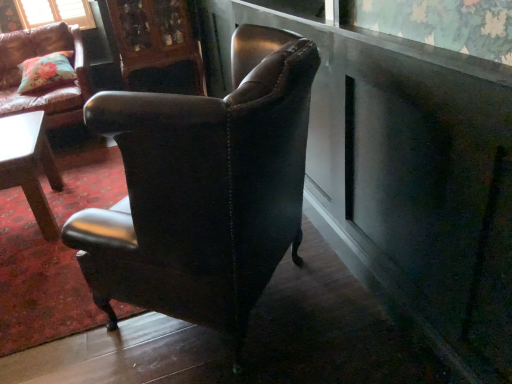
Question: Is floral fabric pillow at upper left facing towards wooden carved cabinet at upper center?

Choices:
 (A) no
 (B) yes

Answer: (A)

Question: From the image's perspective, does floral fabric pillow at upper left appear higher than wooden carved cabinet at upper center?

Choices:
 (A) yes
 (B) no

Answer: (B)

Question: From a real-world perspective, is floral fabric pillow at upper left positioned under wooden carved cabinet at upper center based on gravity?

Choices:
 (A) no
 (B) yes

Answer: (A)

Question: From the image's perspective, is floral fabric pillow at upper left below wooden carved cabinet at upper center?

Choices:
 (A) yes
 (B) no

Answer: (A)

Question: Is floral fabric pillow at upper left at the left side of wooden carved cabinet at upper center?

Choices:
 (A) no
 (B) yes

Answer: (B)

Question: Is floral fabric pillow at upper left not near wooden carved cabinet at upper center?

Choices:
 (A) no
 (B) yes

Answer: (A)

Question: Would you say leather cushioned armchair at upper left, which ranks as the 1th chair in left-to-right order, is part of matte brown leather chair at center, the second chair from the left,'s contents?

Choices:
 (A) no
 (B) yes

Answer: (A)

Question: From a real-world perspective, is matte brown leather chair at center, the second chair from the left, over leather cushioned armchair at upper left, marked as the second chair in a front-to-back arrangement?

Choices:
 (A) yes
 (B) no

Answer: (A)

Question: From a real-world perspective, is matte brown leather chair at center, acting as the 2th chair starting from the back, physically below leather cushioned armchair at upper left, the 1th chair viewed from the back?

Choices:
 (A) no
 (B) yes

Answer: (A)

Question: Is matte brown leather chair at center, the first chair positioned from the front, wider than leather cushioned armchair at upper left, acting as the 2th chair starting from the right?

Choices:
 (A) yes
 (B) no

Answer: (B)

Question: Is matte brown leather chair at center, the second chair from the left, smaller than leather cushioned armchair at upper left, acting as the 2th chair starting from the right?

Choices:
 (A) no
 (B) yes

Answer: (B)

Question: Is matte brown leather chair at center, the first chair positioned from the front, looking in the opposite direction of leather cushioned armchair at upper left, the 1th chair viewed from the back?

Choices:
 (A) no
 (B) yes

Answer: (A)

Question: Is leather cushioned armchair at upper left, the 1th chair viewed from the back, placed right next to matte brown leather chair at center, acting as the 2th chair starting from the back?

Choices:
 (A) yes
 (B) no

Answer: (B)